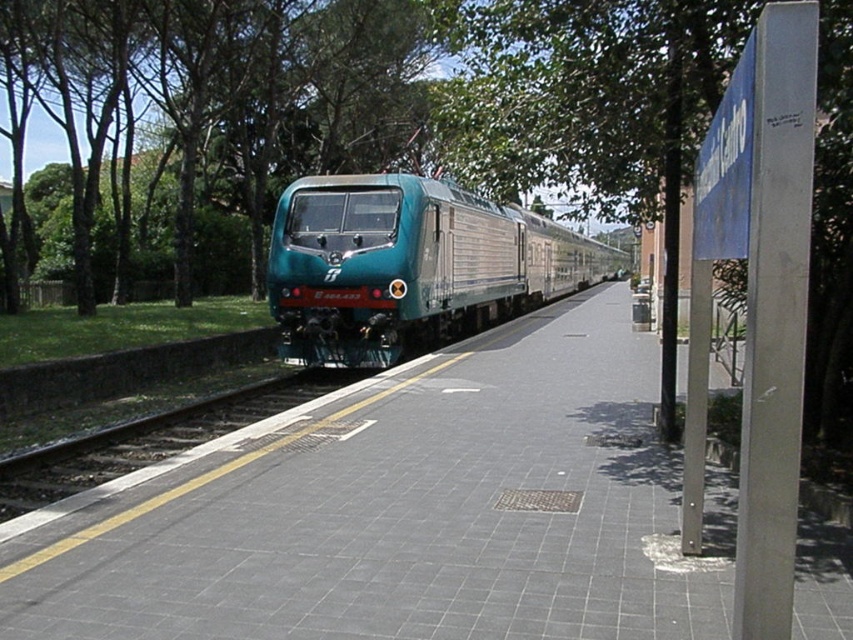
Which is in front, point (715, 44) or point (236, 417)?

Point (715, 44) is in front.

Consider the image. Is green leafy tree at upper center taller than smooth concrete track at center?

Indeed, green leafy tree at upper center has a greater height compared to smooth concrete track at center.

Is point (234, 168) positioned after point (166, 444)?

Yes.

Locate an element on the screen. green leafy tree at upper center is located at coordinates (521, 99).

Which is in front, point (502, 218) or point (35, 477)?

Point (35, 477) is more forward.

Locate an element on the screen. teal glossy train at center is located at coordinates (409, 266).

Which is behind, point (633, 32) or point (376, 305)?

Positioned behind is point (376, 305).

Looking at this image, which is more to the left, green leafy tree at upper center or teal glossy train at center?

Positioned to the left is green leafy tree at upper center.

What do you see at coordinates (521, 99) in the screenshot? This screenshot has width=853, height=640. I see `green leafy tree at upper center` at bounding box center [521, 99].

Locate an element on the screen. This screenshot has height=640, width=853. green leafy tree at upper center is located at coordinates (521, 99).